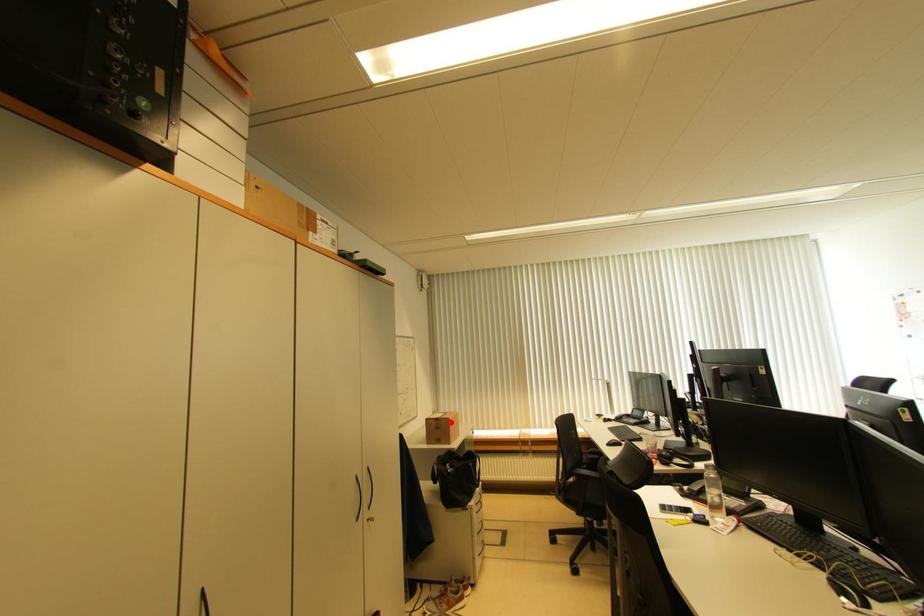
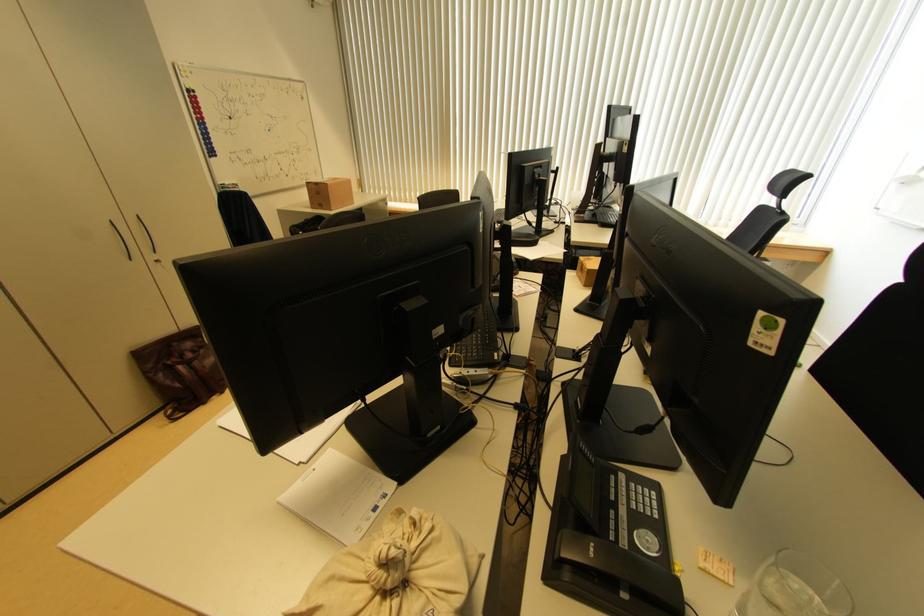
Question: I am providing you with two images of the same scene from different viewpoints. Given a red point in image1, look at the same physical point in image2. Is it:

Choices:
 (A) Closer to the viewpoint
 (B) Farther from the viewpoint

Answer: (A)